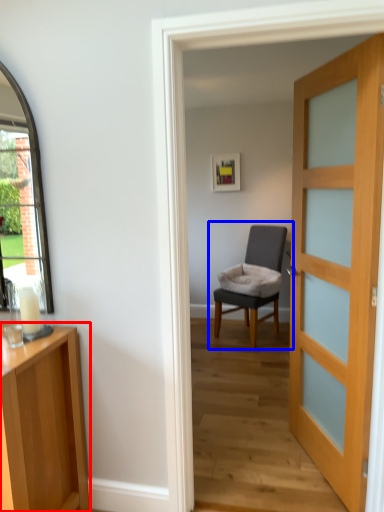
Question: Which of the following is the closest to the observer, cabinetry (highlighted by a red box) or chair (highlighted by a blue box)?

Choices:
 (A) cabinetry
 (B) chair

Answer: (A)